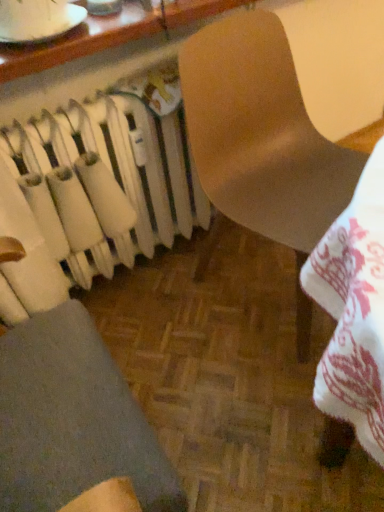
Identify the location of free space underneath matte brown chair at center (from a real-world perspective). The width and height of the screenshot is (384, 512). (264, 283).